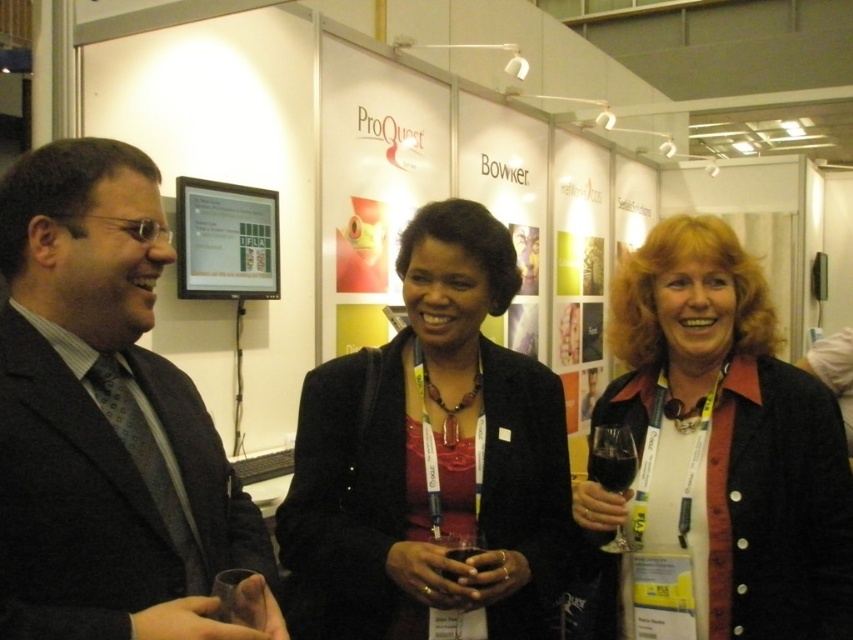
Question: Can you confirm if dark gray suit at center is thinner than matte black jacket at center?

Choices:
 (A) yes
 (B) no

Answer: (A)

Question: Which object is the closest to the matte black jacket at center?

Choices:
 (A) dark red glass at center
 (B) clear glass at center
 (C) dark gray suit at center
 (D) black matte blazer at center

Answer: (A)

Question: Among these objects, which one is farthest from the camera?

Choices:
 (A) black matte blazer at center
 (B) dark gray suit at center
 (C) clear glass at center

Answer: (C)

Question: From the image, what is the correct spatial relationship of dark gray suit at center in relation to transparent glass at center?

Choices:
 (A) above
 (B) below

Answer: (A)

Question: Is dark gray suit at center positioned behind dark red glass at center?

Choices:
 (A) yes
 (B) no

Answer: (B)

Question: Which of the following is the farthest from the observer?

Choices:
 (A) clear glass at center
 (B) black matte blazer at center
 (C) transparent glass at center
 (D) matte black jacket at center

Answer: (D)